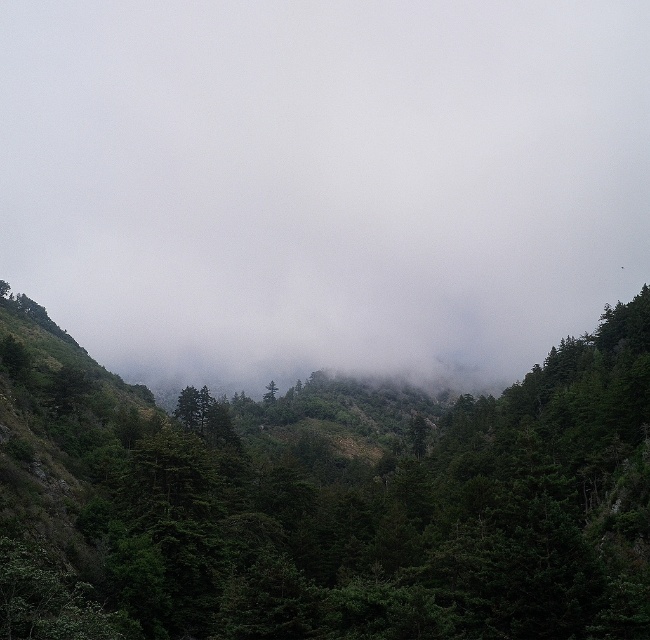
You are a hiker planning to cross the valley between the white foggy cloud at center and the green matte forest at center. Your backpack has a weight limit of 30 kg. The distance between them is 239.59 meters. Can you safely carry a 25 kg backpack and make the journey without exceeding your weight limit?

The distance between the white foggy cloud at center and the green matte forest at center is 239.59 meters. Since the backpack weighs 25 kg, which is under the 30 kg limit, you can safely carry it and cross the valley between them.

You are an explorer lost in the forest. You see the white foggy cloud at center and the green matte forest at center. Which one is positioned to the right side?

The white foggy cloud at center is positioned to the right of the green matte forest at center.